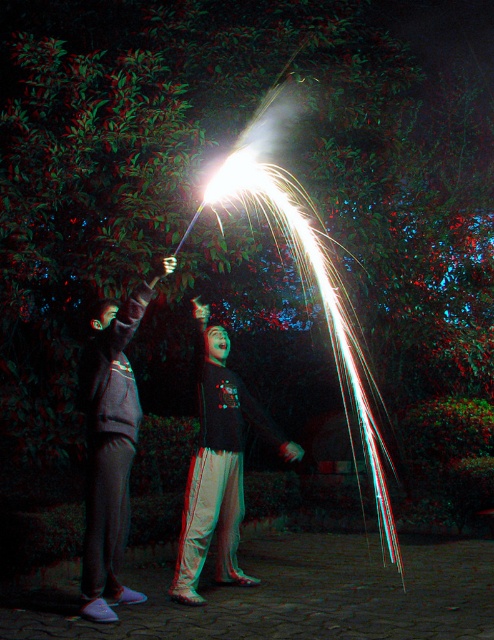
Question: Does gray sweatpants at left appear on the left side of black matte shirt at center?

Choices:
 (A) yes
 (B) no

Answer: (A)

Question: Which point is farther from the camera taking this photo?

Choices:
 (A) (231, 480)
 (B) (134, 440)

Answer: (A)

Question: Which point is farther to the camera?

Choices:
 (A) (99, 337)
 (B) (196, 563)

Answer: (B)

Question: Among these points, which one is farthest from the camera?

Choices:
 (A) (121, 458)
 (B) (213, 422)

Answer: (B)

Question: Is gray sweatpants at left above black matte shirt at center?

Choices:
 (A) yes
 (B) no

Answer: (A)

Question: Is gray sweatpants at left wider than black matte shirt at center?

Choices:
 (A) no
 (B) yes

Answer: (A)